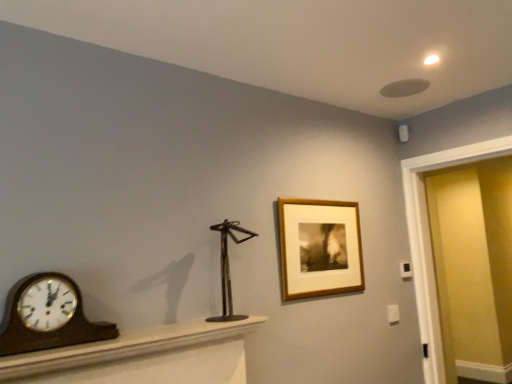
Question: Is metallic sculpture at center smaller than brown wood mantel at lower left?

Choices:
 (A) no
 (B) yes

Answer: (B)

Question: From a real-world perspective, is metallic sculpture at center positioned over brown wood mantel at lower left based on gravity?

Choices:
 (A) yes
 (B) no

Answer: (A)

Question: Is metallic sculpture at center in contact with brown wood mantel at lower left?

Choices:
 (A) no
 (B) yes

Answer: (A)

Question: Does metallic sculpture at center lie behind brown wood mantel at lower left?

Choices:
 (A) no
 (B) yes

Answer: (B)

Question: Is brown wood mantel at lower left a part of metallic sculpture at center?

Choices:
 (A) no
 (B) yes

Answer: (A)

Question: Does metallic sculpture at center have a lesser width compared to brown wood mantel at lower left?

Choices:
 (A) no
 (B) yes

Answer: (B)

Question: Is metallic sculpture at center shorter than matte yellow door at right?

Choices:
 (A) yes
 (B) no

Answer: (A)

Question: Considering the relative sizes of metallic sculpture at center and matte yellow door at right in the image provided, is metallic sculpture at center smaller than matte yellow door at right?

Choices:
 (A) yes
 (B) no

Answer: (A)

Question: Is metallic sculpture at center facing away from matte yellow door at right?

Choices:
 (A) no
 (B) yes

Answer: (A)

Question: Are metallic sculpture at center and matte yellow door at right far apart?

Choices:
 (A) no
 (B) yes

Answer: (B)

Question: Is the depth of metallic sculpture at center less than that of matte yellow door at right?

Choices:
 (A) yes
 (B) no

Answer: (A)

Question: From the image's perspective, is metallic sculpture at center located above matte yellow door at right?

Choices:
 (A) no
 (B) yes

Answer: (B)

Question: Does metallic sculpture at center have a lesser height compared to wooden polished clock at left?

Choices:
 (A) no
 (B) yes

Answer: (A)